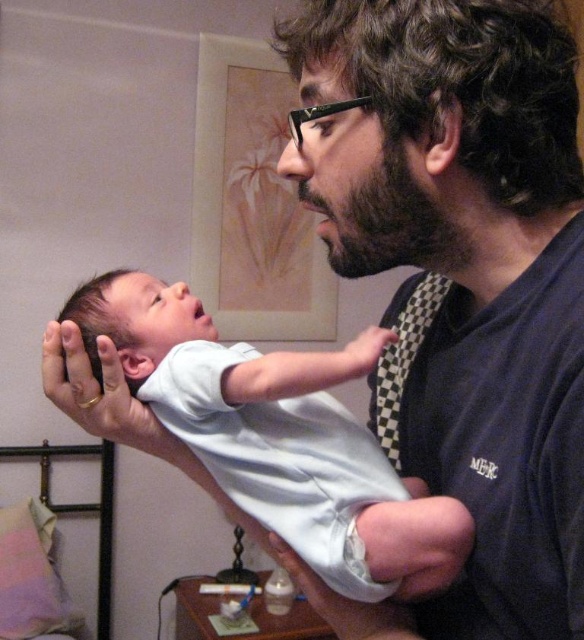
Question: Where is white cotton onesie at center located in relation to matte paper picture frame at upper center in the image?

Choices:
 (A) left
 (B) right

Answer: (B)

Question: Which of the following is the farthest from the observer?

Choices:
 (A) (548, 584)
 (B) (377, 173)
 (C) (303, 444)
 (D) (252, 317)

Answer: (D)

Question: Which of the following is the farthest from the observer?

Choices:
 (A) (366, 198)
 (B) (515, 628)
 (C) (312, 371)

Answer: (C)

Question: Is white cotton onesie at center above dark brown thick beard at center?

Choices:
 (A) yes
 (B) no

Answer: (B)

Question: Considering the relative positions of dark blue shirt at center and dark brown thick beard at center in the image provided, where is dark blue shirt at center located with respect to dark brown thick beard at center?

Choices:
 (A) below
 (B) above

Answer: (A)

Question: Which is nearer to the dark brown thick beard at center?

Choices:
 (A) matte paper picture frame at upper center
 (B) dark blue shirt at center

Answer: (B)